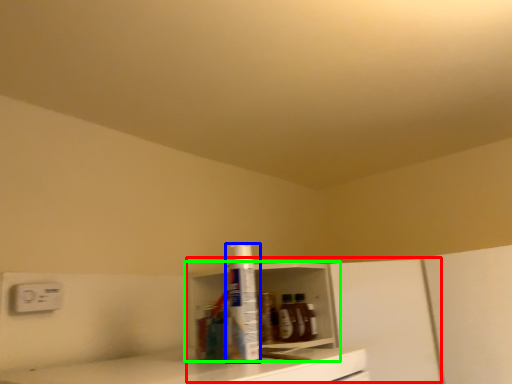
Question: Based on their relative distances, which object is farther from cabinetry (highlighted by a red box)? Choose from bottle (highlighted by a blue box) and shelf (highlighted by a green box).

Choices:
 (A) bottle
 (B) shelf

Answer: (A)